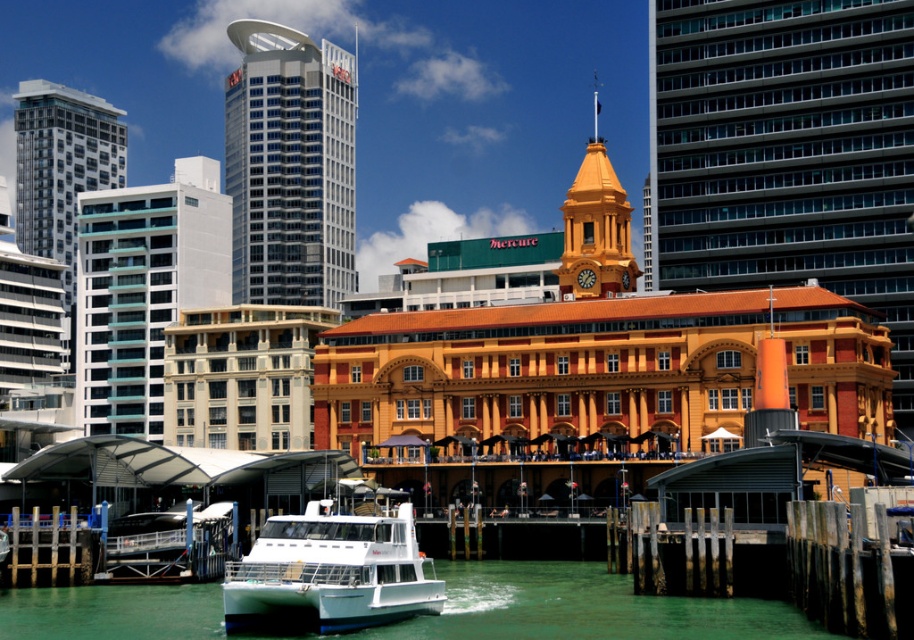
Question: Which point is closer to the camera?

Choices:
 (A) white glass building at left
 (B) white glossy boat at lower center

Answer: (B)

Question: Which point appears closest to the camera in this image?

Choices:
 (A) (330, 67)
 (B) (133, 252)

Answer: (B)

Question: Observing the image, what is the correct spatial positioning of white glass building at left in reference to matte glass building at left?

Choices:
 (A) below
 (B) above

Answer: (A)

Question: Does green water at lower center have a lesser width compared to glassy blue skyscraper at upper left?

Choices:
 (A) no
 (B) yes

Answer: (A)

Question: Which is farther from the white glass building at left?

Choices:
 (A) matte glass building at left
 (B) green water at lower center

Answer: (B)

Question: Can you confirm if green water at lower center is thinner than glassy blue skyscraper at upper left?

Choices:
 (A) yes
 (B) no

Answer: (B)